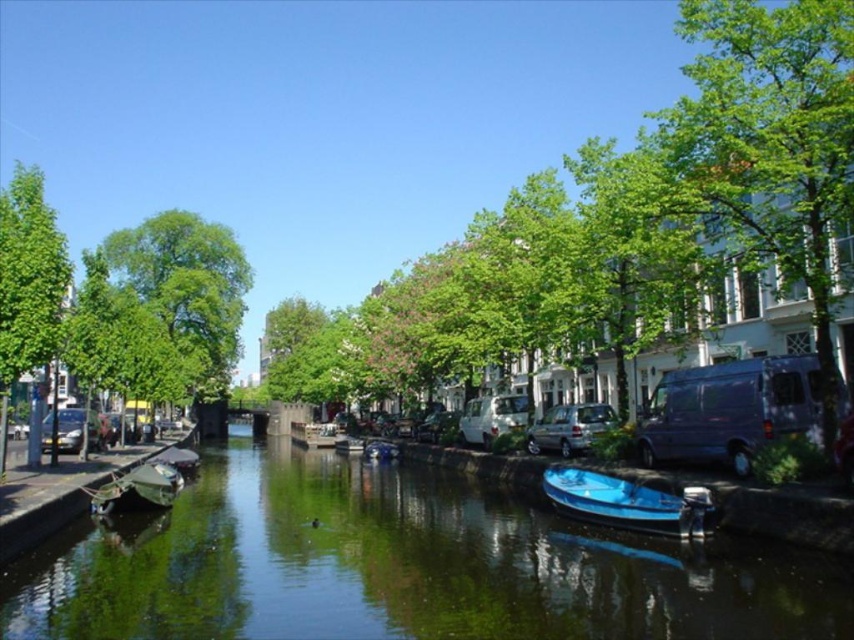
Is green leafy tree at left closer to the viewer compared to green matte boat at center?

Yes, green leafy tree at left is in front of green matte boat at center.

Who is more distant from viewer, [44,360] or [162,500]?

The point [162,500] is more distant.

This screenshot has width=854, height=640. What are the coordinates of `green leafy tree at left` in the screenshot? It's located at (28, 276).

Does green reflective water at center appear under green leafy tree at left?

Yes.

Does green reflective water at center have a lesser width compared to green leafy tree at left?

Correct, green reflective water at center's width is less than green leafy tree at left's.

You are a GUI agent. You are given a task and a screenshot of the screen. Output one action in this format:
    pyautogui.click(x=<x>, y=<y>)
    Task: Click on the green reflective water at center
    This screenshot has height=640, width=854.
    Given the screenshot: What is the action you would take?
    click(399, 566)

Is green leafy tree at upper right positioned in front of green leafy tree at left?

That is True.

Between green leafy tree at upper right and green leafy tree at left, which one has more height?

green leafy tree at upper right is taller.

Between point (765, 64) and point (0, 273), which one is positioned in front?

Point (765, 64) is in front.

Where is `green leafy tree at upper right`? The image size is (854, 640). green leafy tree at upper right is located at coordinates (770, 145).